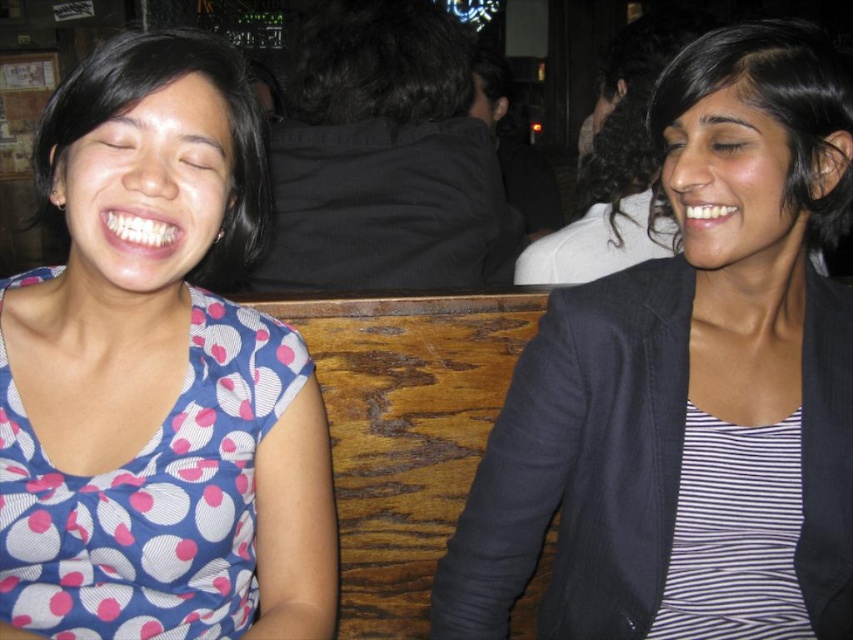
Based on the photo, you are a fashion designer observing two people in a social setting. You notice the striped fabric at center and the blue dotted fabric shirt at left. Which fabric is positioned to the right of the other?

The striped fabric at center is positioned on the right side of blue dotted fabric shirt at left.

You are designing a new clothing line and want to ensure that the striped fabric at center and the blue dotted fabric shirt at left will look balanced in a two model photo shoot. Given their heights, which model should wear which outfit to maintain visual balance?

The striped fabric at center is shorter than the blue dotted fabric shirt at left. To maintain visual balance, the taller model should wear the shorter striped fabric at center, and the shorter model should wear the blue dotted fabric shirt at left.

You are a fashion designer analyzing the image. You need to determine which fabric is visible on top between the striped fabric at center and the blue dotted fabric shirt at left. Which one is on top?

The striped fabric at center is positioned over the blue dotted fabric shirt at left, so the striped fabric at center is on top.